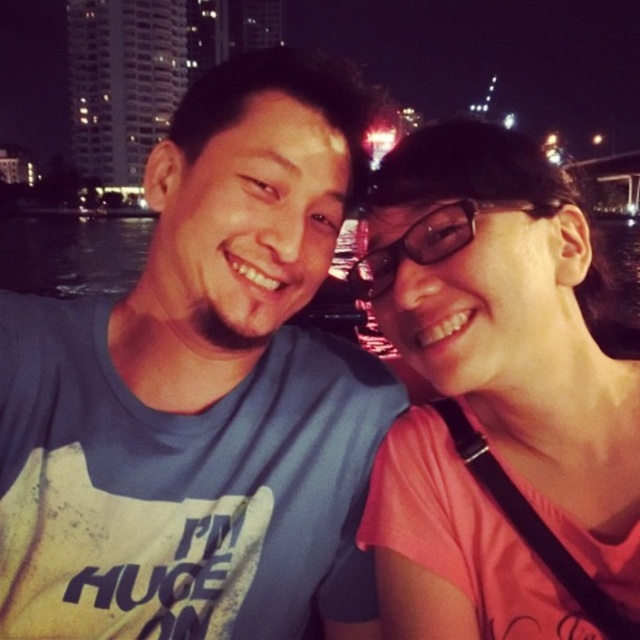
Is blue cotton t-shirt at center positioned before pink matte shirt at upper right?

→ That is False.

Who is more distant from viewer, [189,237] or [560,566]?

The point [189,237] is behind.

Identify the location of blue cotton t-shirt at center. The width and height of the screenshot is (640, 640). (202, 392).

Does blue cotton t-shirt at center appear over transparent plastic glasses at center?

Actually, blue cotton t-shirt at center is below transparent plastic glasses at center.

Is blue cotton t-shirt at center positioned before transparent plastic glasses at center?

Yes, it is.

Between point (10, 339) and point (452, 237), which one is positioned in front?

Point (10, 339) is more forward.

You are a GUI agent. You are given a task and a screenshot of the screen. Output one action in this format:
    pyautogui.click(x=<x>, y=<y>)
    Task: Click on the blue cotton t-shirt at center
    The height and width of the screenshot is (640, 640).
    Given the screenshot: What is the action you would take?
    [202, 392]

Which is below, pink matte shirt at upper right or transparent plastic glasses at center?

→ pink matte shirt at upper right is lower down.

In the scene shown: Does pink matte shirt at upper right have a lesser height compared to transparent plastic glasses at center?

No, pink matte shirt at upper right is not shorter than transparent plastic glasses at center.

The height and width of the screenshot is (640, 640). Find the location of `pink matte shirt at upper right`. pink matte shirt at upper right is located at coordinates coord(497,401).

Locate an element on the screen. The height and width of the screenshot is (640, 640). pink matte shirt at upper right is located at coordinates click(497, 401).